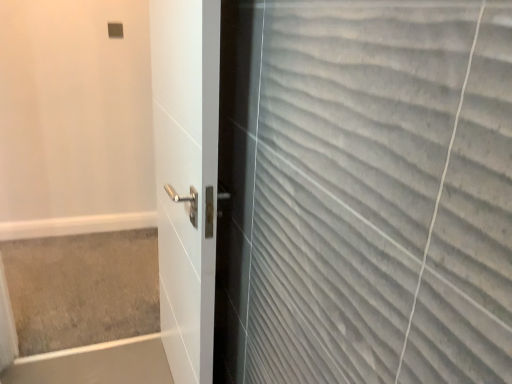
What do you see at coordinates (186, 177) in the screenshot? The width and height of the screenshot is (512, 384). I see `white glossy door at center` at bounding box center [186, 177].

Measure the distance between white glossy door at center and camera.

white glossy door at center and camera are 37.74 inches apart from each other.

Where is `white glossy door at center`? white glossy door at center is located at coordinates (186, 177).

This screenshot has width=512, height=384. Find the location of `white glossy door at center`. white glossy door at center is located at coordinates (186, 177).